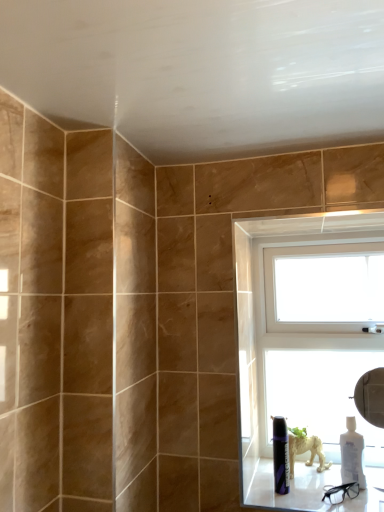
Locate an element on the screen. This screenshot has width=384, height=512. vacant area that is in front of matte black can at lower right is located at coordinates (297, 503).